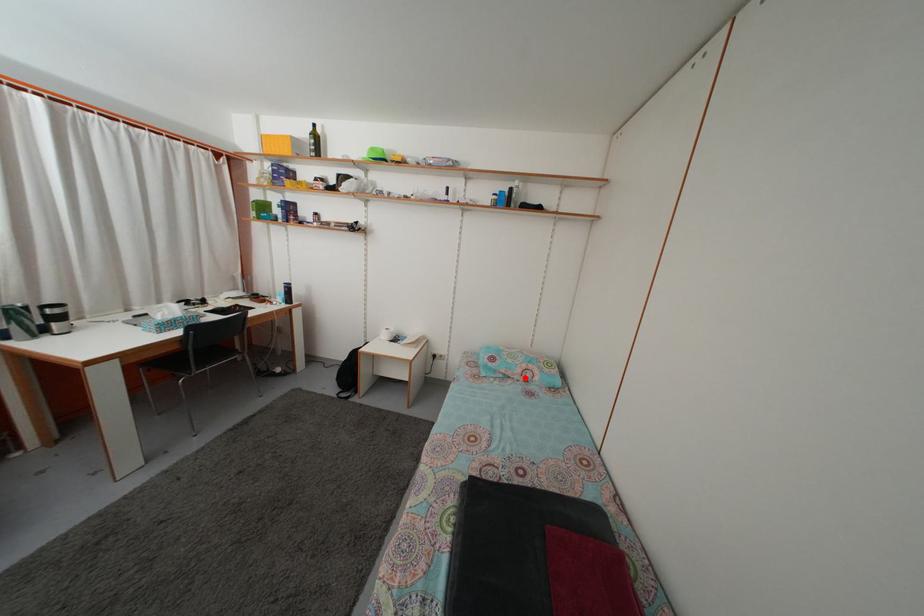
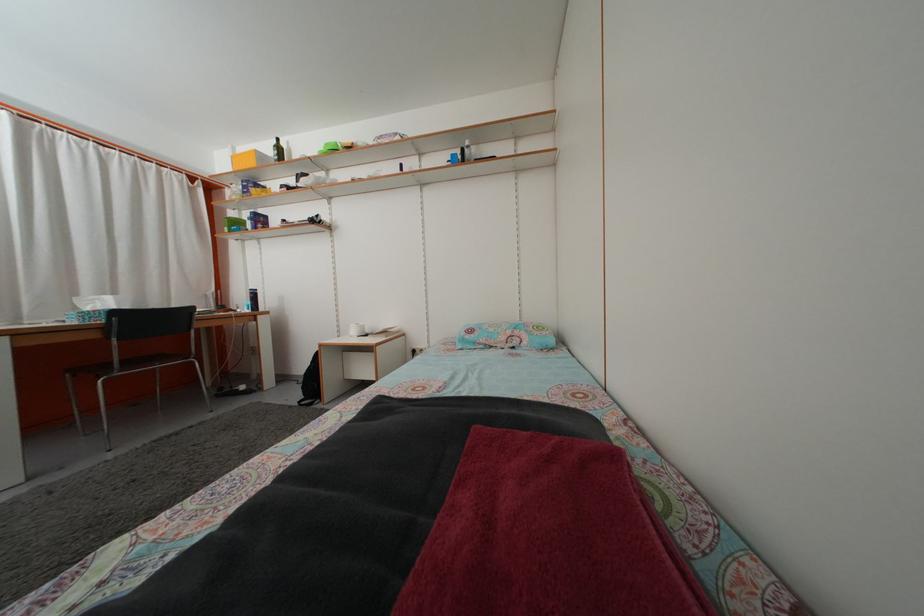
Locate, in the second image, the point that corresponds to the highlighted location in the first image.

(508, 346)